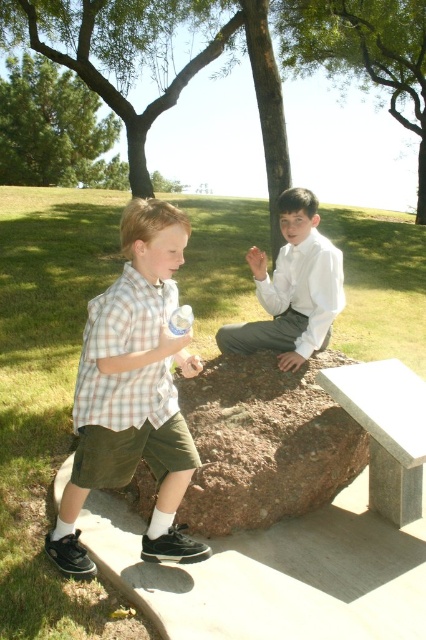
Question: Which of the following is the farthest from the observer?

Choices:
 (A) (121, 244)
 (B) (276, 282)
 (C) (262, 493)
 (D) (190, 307)

Answer: (D)

Question: Among these objects, which one is nearest to the camera?

Choices:
 (A) plaid cotton shirt at left
 (B) clear plastic bottle at center
 (C) brown rough boulder at center

Answer: (B)

Question: Does plaid cotton shirt at left appear under white satin shirt at center?

Choices:
 (A) yes
 (B) no

Answer: (A)

Question: Is brown rough boulder at center in front of clear plastic bottle at center?

Choices:
 (A) yes
 (B) no

Answer: (B)

Question: Observing the image, what is the correct spatial positioning of plaid cotton shirt at left in reference to clear plastic bottle at center?

Choices:
 (A) below
 (B) above

Answer: (A)

Question: Among these points, which one is farthest from the camera?

Choices:
 (A) (224, 344)
 (B) (334, 449)
 (C) (184, 307)

Answer: (A)